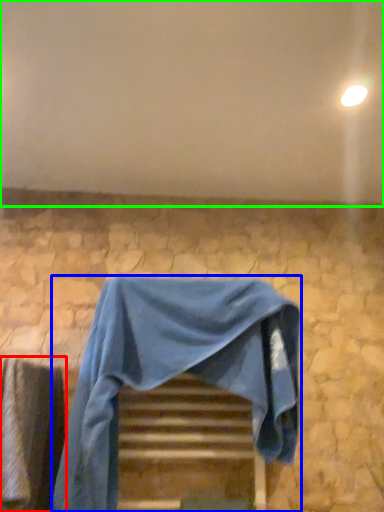
Question: Which object is positioned farthest from curtain (highlighted by a red box)? Select from furniture (highlighted by a blue box) and backdrop (highlighted by a green box).

Choices:
 (A) furniture
 (B) backdrop

Answer: (B)